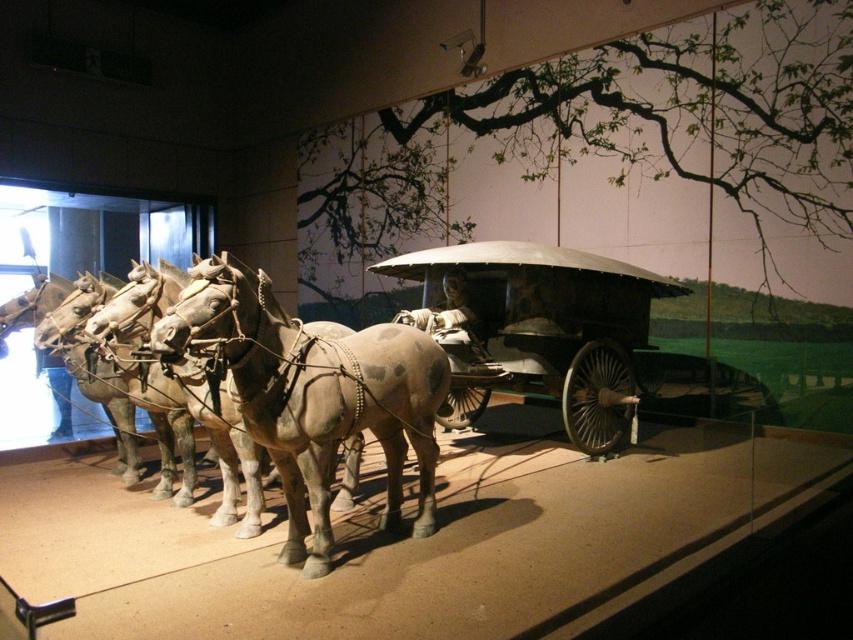
Question: Is brown matte horse at center positioned at the back of polished wood wagon at center?

Choices:
 (A) no
 (B) yes

Answer: (A)

Question: Is brown matte horse at center smaller than polished wood wagon at center?

Choices:
 (A) yes
 (B) no

Answer: (A)

Question: Which point is farther to the camera?

Choices:
 (A) (463, 396)
 (B) (308, 364)

Answer: (A)

Question: Can you confirm if brown matte horse at center is positioned below polished wood wagon at center?

Choices:
 (A) no
 (B) yes

Answer: (B)